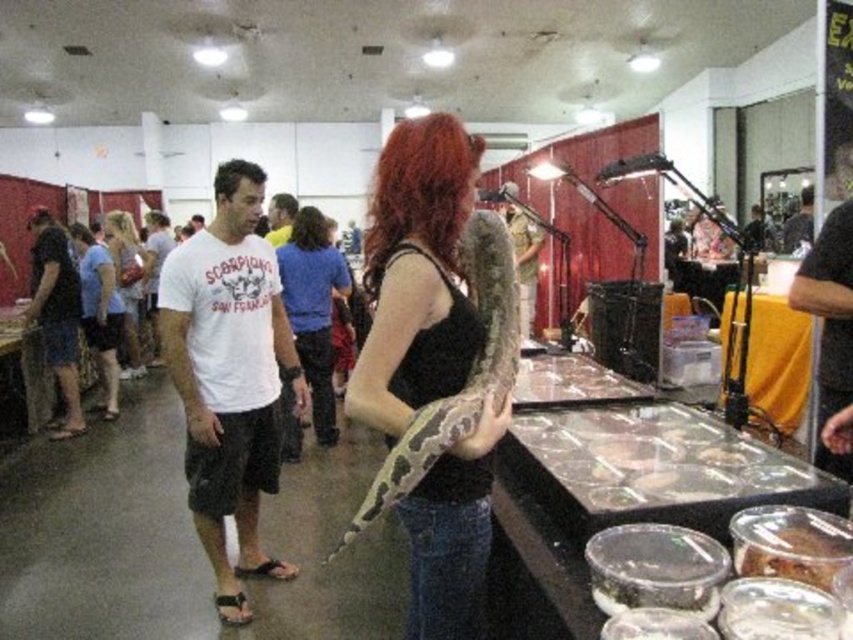
Question: Which object appears closest to the camera in this image?

Choices:
 (A) matte black tank top at center
 (B) yellow fabric table at center

Answer: (A)

Question: Can you confirm if matte black tank top at center is positioned to the left of white matte shirt at center?

Choices:
 (A) no
 (B) yes

Answer: (A)

Question: Which point is closer to the camera taking this photo?

Choices:
 (A) (418, 589)
 (B) (132, 262)

Answer: (A)

Question: Does matte black tank top at center have a smaller size compared to white matte shirt at center?

Choices:
 (A) no
 (B) yes

Answer: (B)

Question: Which of these objects is positioned farthest from the matte black shirt at center?

Choices:
 (A) yellow fabric table at center
 (B) white cotton t-shirt at center

Answer: (A)

Question: Does white cotton t-shirt at center appear on the left side of white matte shirt at center?

Choices:
 (A) yes
 (B) no

Answer: (B)